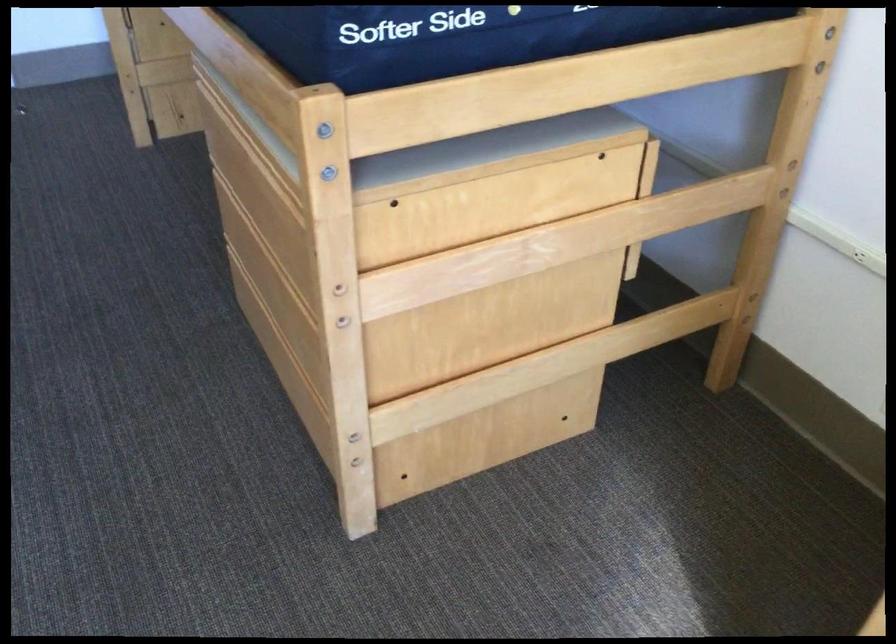
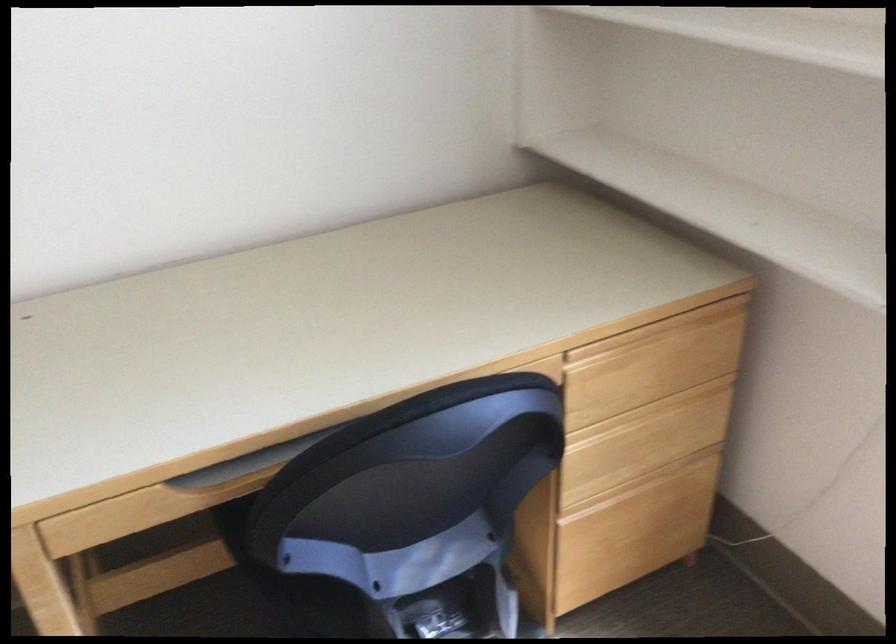
How did the camera likely rotate?

The camera's rotation is toward right-down.